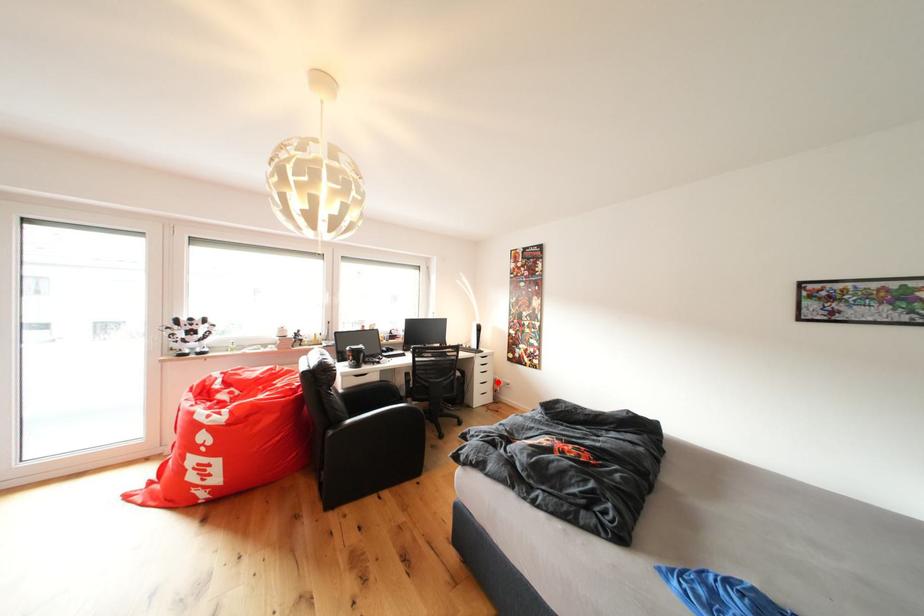
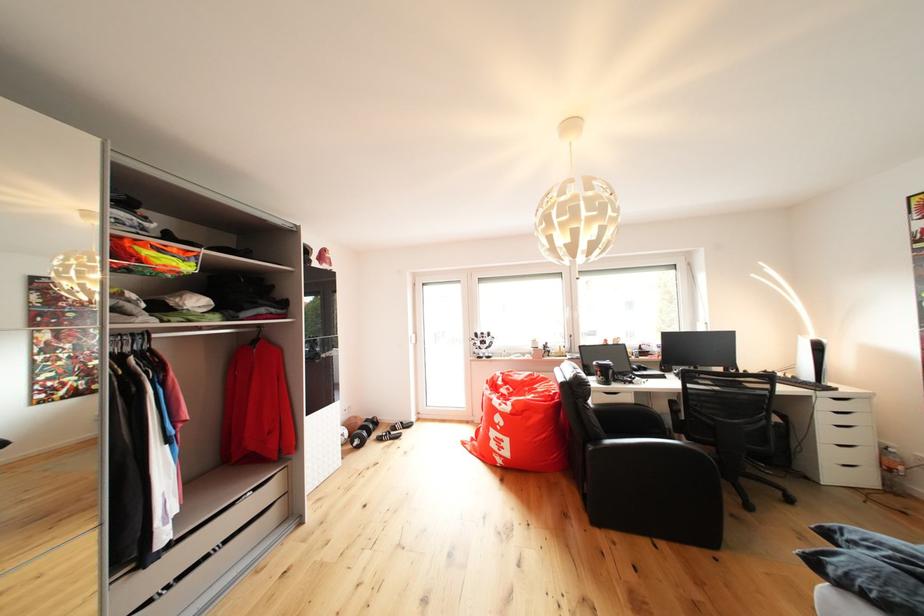
Where in the second image is the point corresponding to the highlighted location from the first image?

(869, 444)